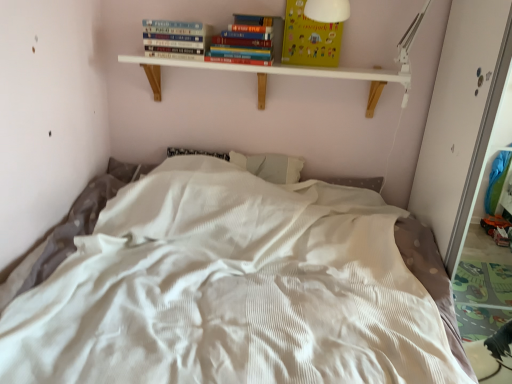
Question: From the image's perspective, is white wood shelf at upper center below yellow paper at upper center?

Choices:
 (A) no
 (B) yes

Answer: (B)

Question: Does white wood shelf at upper center have a greater width compared to yellow paper at upper center?

Choices:
 (A) yes
 (B) no

Answer: (A)

Question: Is white wood shelf at upper center positioned behind yellow paper at upper center?

Choices:
 (A) yes
 (B) no

Answer: (B)

Question: Is white wood shelf at upper center turned away from yellow paper at upper center?

Choices:
 (A) yes
 (B) no

Answer: (B)

Question: From a real-world perspective, is white wood shelf at upper center over yellow paper at upper center?

Choices:
 (A) no
 (B) yes

Answer: (A)

Question: Considering the relative sizes of white wood shelf at upper center and yellow paper at upper center in the image provided, is white wood shelf at upper center smaller than yellow paper at upper center?

Choices:
 (A) yes
 (B) no

Answer: (B)

Question: Is white textured bed at center looking in the opposite direction of white wood shelf at upper center?

Choices:
 (A) yes
 (B) no

Answer: (B)

Question: Is white textured bed at center taller than white wood shelf at upper center?

Choices:
 (A) no
 (B) yes

Answer: (B)

Question: Is white wood shelf at upper center inside white textured bed at center?

Choices:
 (A) no
 (B) yes

Answer: (A)

Question: Can you confirm if white textured bed at center is shorter than white wood shelf at upper center?

Choices:
 (A) yes
 (B) no

Answer: (B)

Question: From the image's perspective, would you say white textured bed at center is positioned over white wood shelf at upper center?

Choices:
 (A) no
 (B) yes

Answer: (A)

Question: Is white textured bed at center facing towards white wood shelf at upper center?

Choices:
 (A) yes
 (B) no

Answer: (B)

Question: Is yellow paper at upper center to the left of white textured bed at center from the viewer's perspective?

Choices:
 (A) no
 (B) yes

Answer: (A)